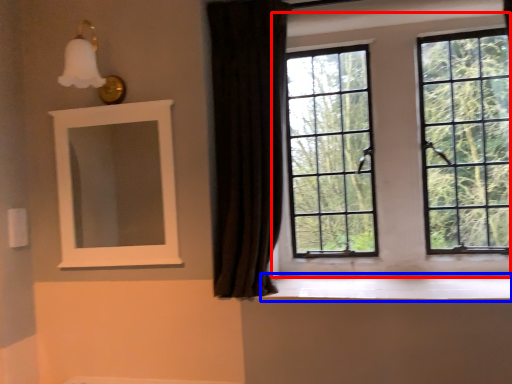
Question: Which point is closer to the camera, window (highlighted by a red box) or window sill (highlighted by a blue box)?

Choices:
 (A) window
 (B) window sill

Answer: (B)